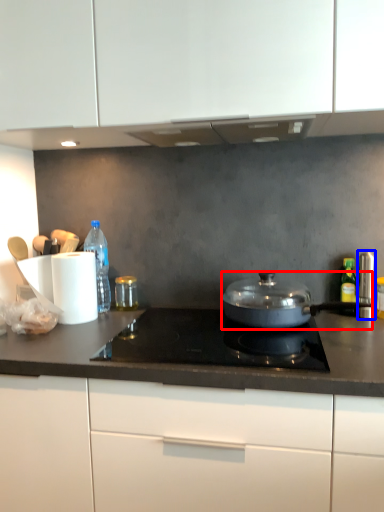
Question: Which object appears farthest to the camera in this image, kitchen appliance (highlighted by a red box) or appliance (highlighted by a blue box)?

Choices:
 (A) kitchen appliance
 (B) appliance

Answer: (B)